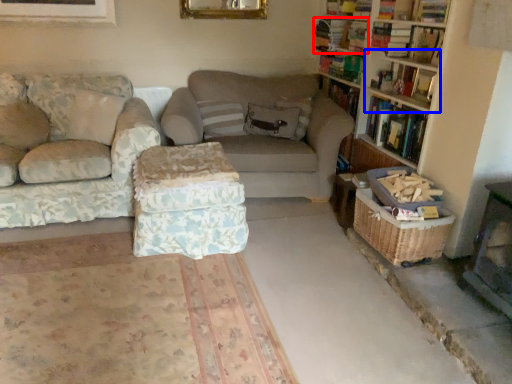
Question: Which object is closer to the camera taking this photo, book (highlighted by a red box) or shelf (highlighted by a blue box)?

Choices:
 (A) book
 (B) shelf

Answer: (B)